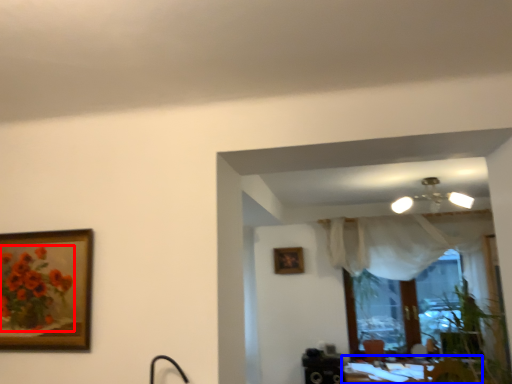
Question: Which of the following is the farthest to the observer, flower (highlighted by a red box) or table (highlighted by a blue box)?

Choices:
 (A) flower
 (B) table

Answer: (B)